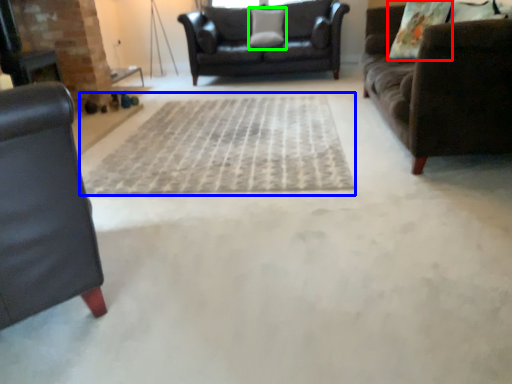
Question: Based on their relative distances, which object is nearer to pillow (highlighted by a red box)? Choose from doormat (highlighted by a blue box) and pillow (highlighted by a green box).

Choices:
 (A) doormat
 (B) pillow

Answer: (A)